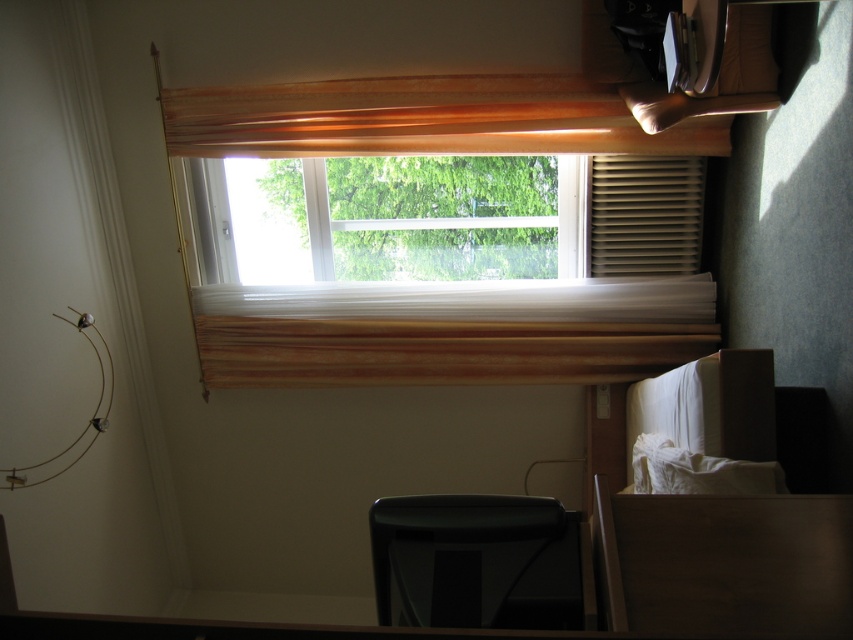
Looking at this image, you are moving furniture in a hotel room and need to place the black plastic chair at lower center next to the matte brown blind at right. Will the chair fit next to the blind without overlapping?

The black plastic chair at lower center is smaller than the matte brown blind at right, so it should fit next to the blind without overlapping.

You are standing in a hotel room and want to adjust the wooden blind at upper center to let more light in. If the blind is currently at position coordinates point 0.186, 0.497, what direction should you move it to allow more light?

The wooden blind at upper center is positioned at point (422, 118). To allow more light, you should move it upwards to increase the gap between the blind and the window frame, letting more natural light enter the room.

You are standing in a room and see the black plastic chair at lower center and the matte brown blind at right. Which object is positioned to the left of the other?

The black plastic chair at lower center is positioned to the left of the matte brown blind at right.